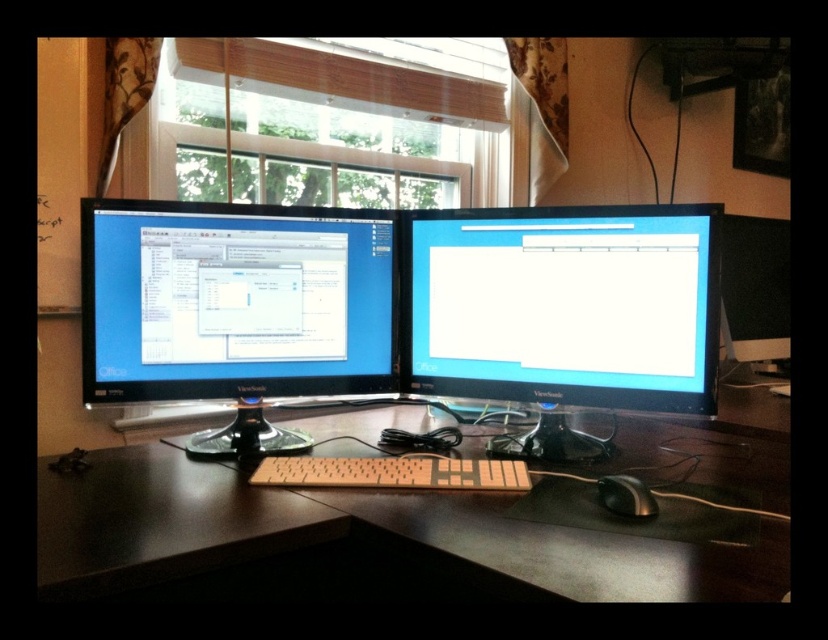
Is matte black monitor at center to the left of white matte keyboard at center from the viewer's perspective?

Incorrect, matte black monitor at center is not on the left side of white matte keyboard at center.

Is matte black monitor at center bigger than white matte keyboard at center?

Indeed, matte black monitor at center has a larger size compared to white matte keyboard at center.

Is point (501, 260) closer to viewer compared to point (362, 481)?

That is False.

Where is `matte black monitor at center`? matte black monitor at center is located at coordinates (562, 305).

Between point (764, 220) and point (363, 486), which one is positioned in front?

Point (363, 486)

Locate an element on the screen. black glossy monitor at right is located at coordinates (754, 291).

Between point (759, 486) and point (490, 358), which one is positioned behind?

The point (490, 358) is behind.

Which is in front, point (658, 528) or point (448, 253)?

Point (658, 528) is more forward.

At what (x,y) coordinates should I click in order to perform the action: click on black matte computer desk at center. Please return your answer as a coordinate pair (x, y). Looking at the image, I should click on (366, 525).